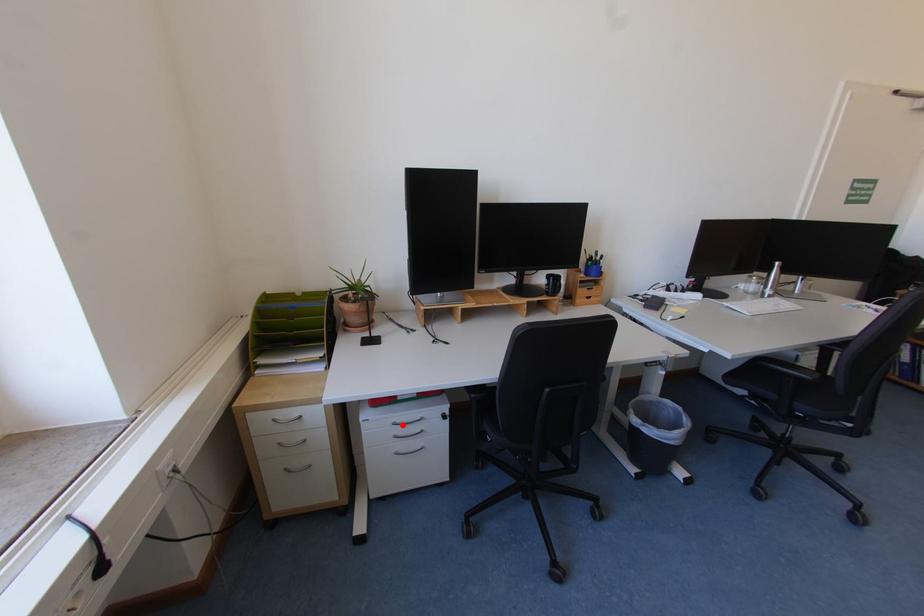
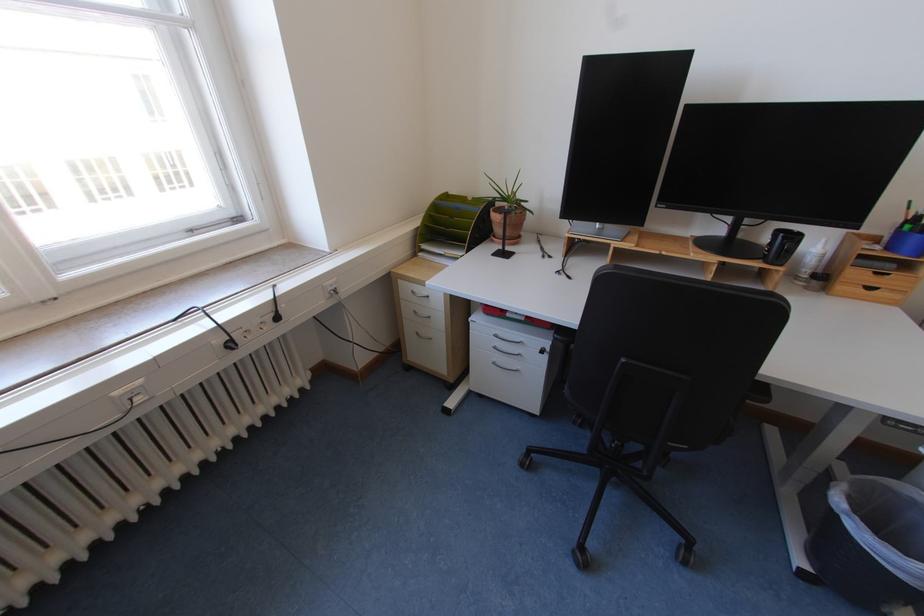
Where in the second image is the point corresponding to the highlighted location from the first image?

(504, 337)